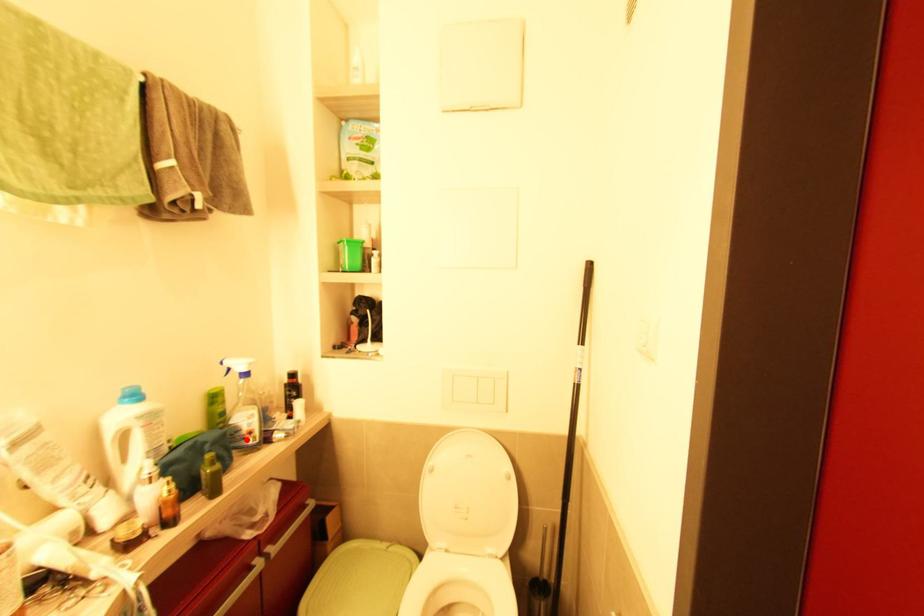
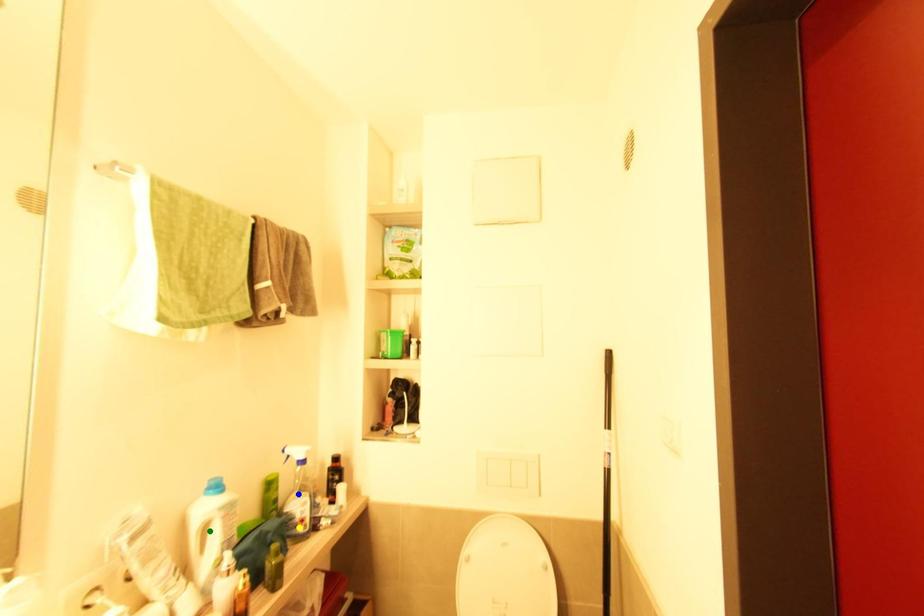
Question: I am providing you with two images of the same scene from different viewpoints. A red point is marked on the first image. You are given multiple points on the second image. Which point in image 2 is actually the same real-world point as the red point in image 1?

Choices:
 (A) blue point
 (B) yellow point
 (C) green point

Answer: (B)